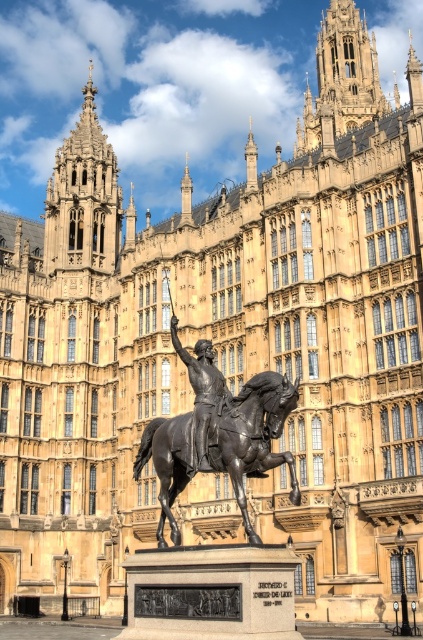
From the picture: Which is more to the left, bronze textured horse at center or bronze statue at center?

bronze statue at center is more to the left.

Is bronze textured horse at center closer to camera compared to bronze statue at center?

Yes, bronze textured horse at center is in front of bronze statue at center.

You are a GUI agent. You are given a task and a screenshot of the screen. Output one action in this format:
    pyautogui.click(x=<x>, y=<y>)
    Task: Click on the bronze textured horse at center
    The width and height of the screenshot is (423, 640).
    Given the screenshot: What is the action you would take?
    pyautogui.click(x=255, y=436)

Based on the photo, does bronze textured horse at center come behind golden stone tower at upper left?

That is False.

Between point (175, 477) and point (47, 236), which one is positioned behind?

The point (47, 236) is behind.

Is point (180, 438) farther from viewer compared to point (77, 227)?

No.

Image resolution: width=423 pixels, height=640 pixels. In order to click on bronze textured horse at center in this screenshot , I will do `click(255, 436)`.

Who is more distant from viewer, (222, 408) or (337, 100)?

Point (337, 100)

Is point (173, 488) closer to camera compared to point (370, 92)?

Yes, point (173, 488) is in front of point (370, 92).

Is point (219, 461) less distant than point (349, 52)?

Yes, it is.

You are a GUI agent. You are given a task and a screenshot of the screen. Output one action in this format:
    pyautogui.click(x=<x>, y=<y>)
    Task: Click on the bronze textured horse at center
    The width and height of the screenshot is (423, 640).
    Given the screenshot: What is the action you would take?
    pos(255,436)